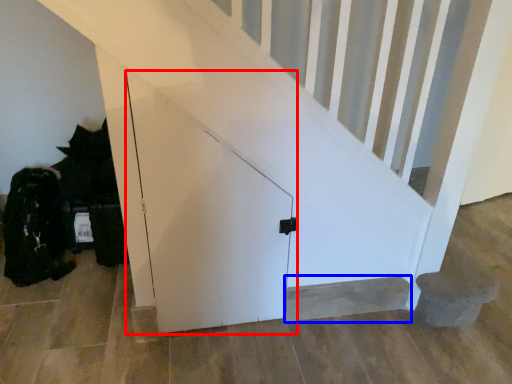
Question: Which object is closer to the camera taking this photo, door (highlighted by a red box) or stairwell (highlighted by a blue box)?

Choices:
 (A) door
 (B) stairwell

Answer: (A)